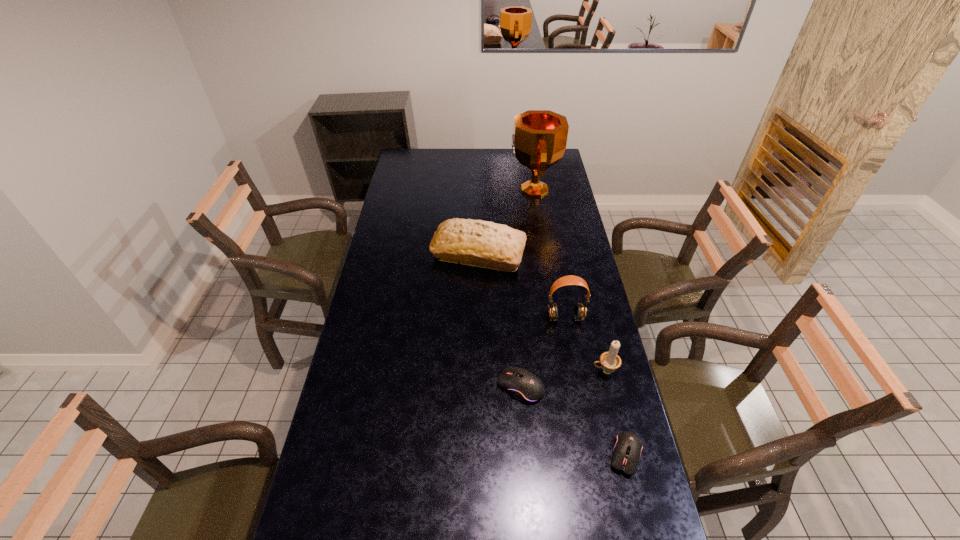
Locate an element on the screen. vacant area located on the back of the second shortest object is located at coordinates (517, 343).

The image size is (960, 540). I want to click on vacant space situated 0.180m on the back of the right computer mouse, so click(x=608, y=382).

Identify the location of vacant space located on the front of the second farthest object. (478, 287).

Identify the location of blank space located on the side of the farthest object with the star emblem. This screenshot has width=960, height=540. (460, 190).

I want to click on free point located 0.310m on the side of the farthest object with the star emblem, so click(x=448, y=190).

The height and width of the screenshot is (540, 960). In order to click on free space located on the side of the farthest object with the star emblem in this screenshot , I will do `click(441, 190)`.

Where is `blank space located 0.350m on the ear cups of the headset`? The width and height of the screenshot is (960, 540). blank space located 0.350m on the ear cups of the headset is located at coordinates (583, 413).

At what (x,y) coordinates should I click in order to perform the action: click on vacant space located 0.110m on the handle side of the candle_holder. Please return your answer as a coordinate pair (x, y). Looking at the image, I should click on (559, 372).

Find the location of `vacant space located on the handle side of the candle_holder`. vacant space located on the handle side of the candle_holder is located at coordinates (573, 372).

Image resolution: width=960 pixels, height=540 pixels. I want to click on vacant space located 0.220m on the handle side of the candle_holder, so click(525, 372).